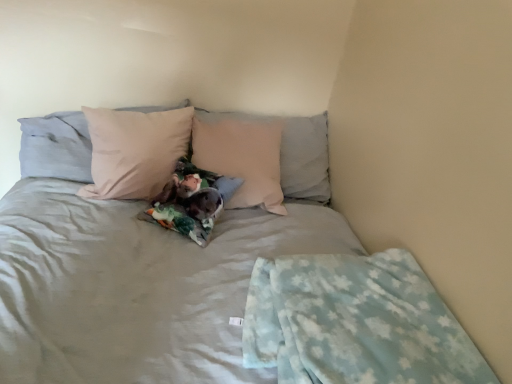
Question: Is light pink fabric pillow at center, which appears as the first pillow when viewed from the right, with matte pink pillow at upper left, acting as the second pillow starting from the right?

Choices:
 (A) no
 (B) yes

Answer: (A)

Question: Considering the relative positions of light pink fabric pillow at center, which appears as the first pillow when viewed from the right, and matte pink pillow at upper left, acting as the second pillow starting from the right, in the image provided, is light pink fabric pillow at center, which appears as the first pillow when viewed from the right, to the right of matte pink pillow at upper left, acting as the second pillow starting from the right, from the viewer's perspective?

Choices:
 (A) no
 (B) yes

Answer: (B)

Question: Is matte pink pillow at upper left, the 1th pillow viewed from the left, surrounded by light pink fabric pillow at center, acting as the 2th pillow starting from the left?

Choices:
 (A) no
 (B) yes

Answer: (A)

Question: Can we say light pink fabric pillow at center, which appears as the first pillow when viewed from the right, lies outside matte pink pillow at upper left, the 1th pillow viewed from the left?

Choices:
 (A) yes
 (B) no

Answer: (A)

Question: Is light pink fabric pillow at center, acting as the 2th pillow starting from the left, at the left side of matte pink pillow at upper left, acting as the second pillow starting from the right?

Choices:
 (A) no
 (B) yes

Answer: (A)

Question: Does point (42, 125) appear closer or farther from the camera than point (275, 117)?

Choices:
 (A) closer
 (B) farther

Answer: (A)

Question: Would you say matte pink pillow at upper left, the 1th pillow viewed from the left, is inside or outside light pink fabric pillow at center, acting as the 2th pillow starting from the left?

Choices:
 (A) outside
 (B) inside

Answer: (A)

Question: Looking at their shapes, would you say matte pink pillow at upper left, acting as the second pillow starting from the right, is wider or thinner than light pink fabric pillow at center, which appears as the first pillow when viewed from the right?

Choices:
 (A) wide
 (B) thin

Answer: (A)

Question: Based on their sizes in the image, would you say matte pink pillow at upper left, acting as the second pillow starting from the right, is bigger or smaller than light pink fabric pillow at center, acting as the 2th pillow starting from the left?

Choices:
 (A) big
 (B) small

Answer: (A)

Question: Is point (382, 291) closer or farther from the camera than point (30, 127)?

Choices:
 (A) farther
 (B) closer

Answer: (B)

Question: In terms of width, does light blue fleece blanket at lower right look wider or thinner when compared to matte pink pillow at upper left, the 1th pillow viewed from the left?

Choices:
 (A) thin
 (B) wide

Answer: (A)

Question: Is light blue fleece blanket at lower right to the left or to the right of matte pink pillow at upper left, the 1th pillow viewed from the left, in the image?

Choices:
 (A) left
 (B) right

Answer: (B)

Question: Considering the positions of light blue fleece blanket at lower right and matte pink pillow at upper left, the 1th pillow viewed from the left, in the image, is light blue fleece blanket at lower right bigger or smaller than matte pink pillow at upper left, the 1th pillow viewed from the left,?

Choices:
 (A) big
 (B) small

Answer: (B)

Question: In terms of height, does matte pink pillow at upper left, the 1th pillow viewed from the left, look taller or shorter compared to light blue fleece blanket at lower right?

Choices:
 (A) tall
 (B) short

Answer: (A)

Question: Is point (66, 155) closer or farther from the camera than point (251, 352)?

Choices:
 (A) closer
 (B) farther

Answer: (B)